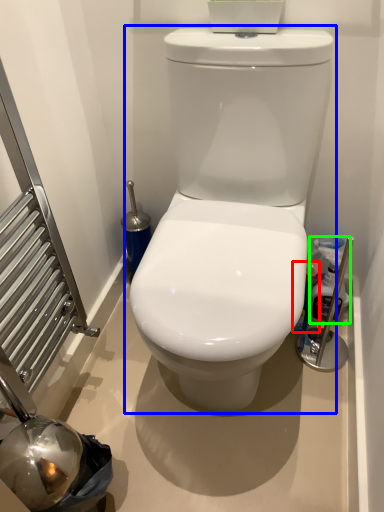
Question: Which is nearer to the cleaning product (highlighted by a red box)? toilet (highlighted by a blue box) or cleaning product (highlighted by a green box).

Choices:
 (A) toilet
 (B) cleaning product

Answer: (B)